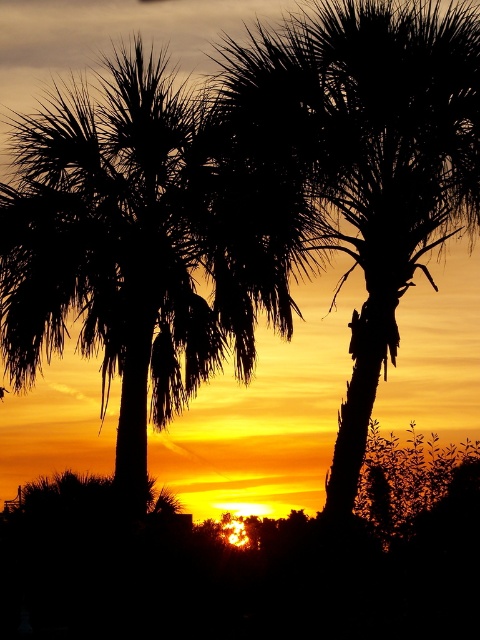
Question: Is black silhouette palm tree at left bigger than black textured palm tree at center?

Choices:
 (A) no
 (B) yes

Answer: (B)

Question: Does black silhouette palm tree at left appear over black textured palm tree at center?

Choices:
 (A) no
 (B) yes

Answer: (A)

Question: Can you confirm if black silhouette palm tree at left is positioned to the right of black textured palm tree at center?

Choices:
 (A) yes
 (B) no

Answer: (B)

Question: Among these objects, which one is farthest from the camera?

Choices:
 (A) black silhouette palm tree at left
 (B) black textured palm tree at center

Answer: (B)